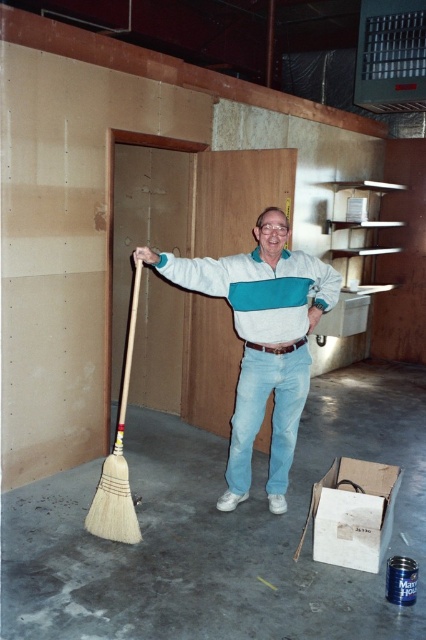
Question: From the image, what is the correct spatial relationship of white cotton sweater at center in relation to white bristle broom at lower left?

Choices:
 (A) above
 (B) below

Answer: (A)

Question: Can you confirm if natural wood broom at center is positioned above white cotton sweater at center?

Choices:
 (A) yes
 (B) no

Answer: (B)

Question: Based on their relative distances, which object is farther from the white cotton sweater at center?

Choices:
 (A) natural wood broom at center
 (B) white bristle broom at lower left

Answer: (A)

Question: Based on their relative distances, which object is farther from the white bristle broom at lower left?

Choices:
 (A) white cotton sweater at center
 (B) natural wood broom at center

Answer: (B)

Question: Is white cotton sweater at center positioned in front of white bristle broom at lower left?

Choices:
 (A) yes
 (B) no

Answer: (B)

Question: Estimate the real-world distances between objects in this image. Which object is farther from the white bristle broom at lower left?

Choices:
 (A) natural wood broom at center
 (B) white cotton sweater at center

Answer: (A)